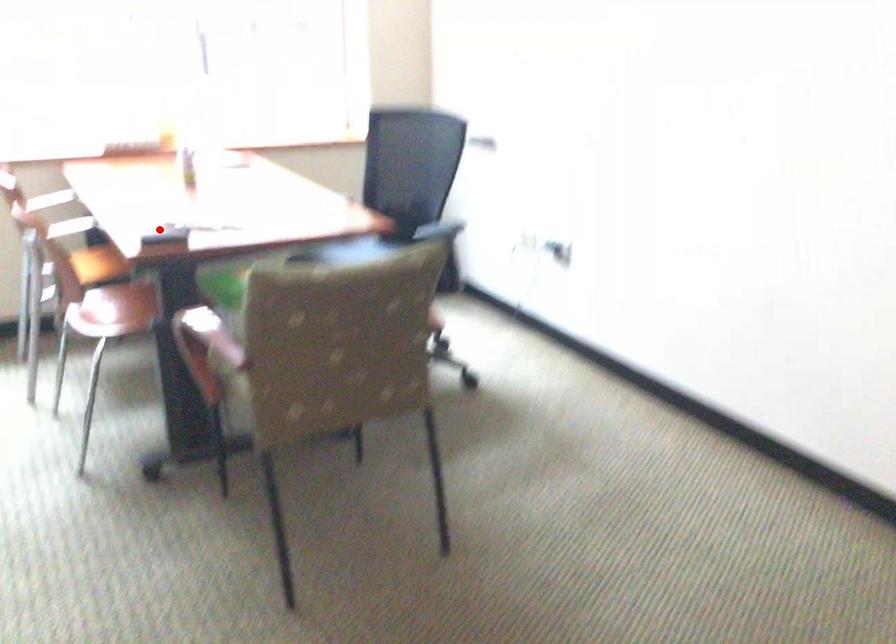
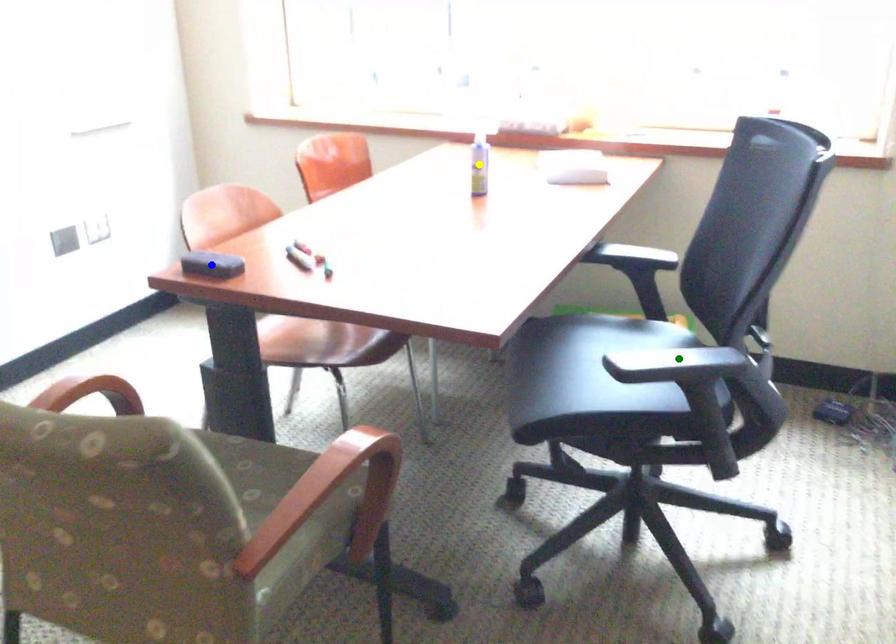
Question: I am providing you with two images of the same scene from different viewpoints. A red point is marked on the first image. You are given multiple points on the second image. Which point in image 2 represents the same 3d spot as the red point in image 1?

Choices:
 (A) yellow point
 (B) green point
 (C) blue point

Answer: (C)